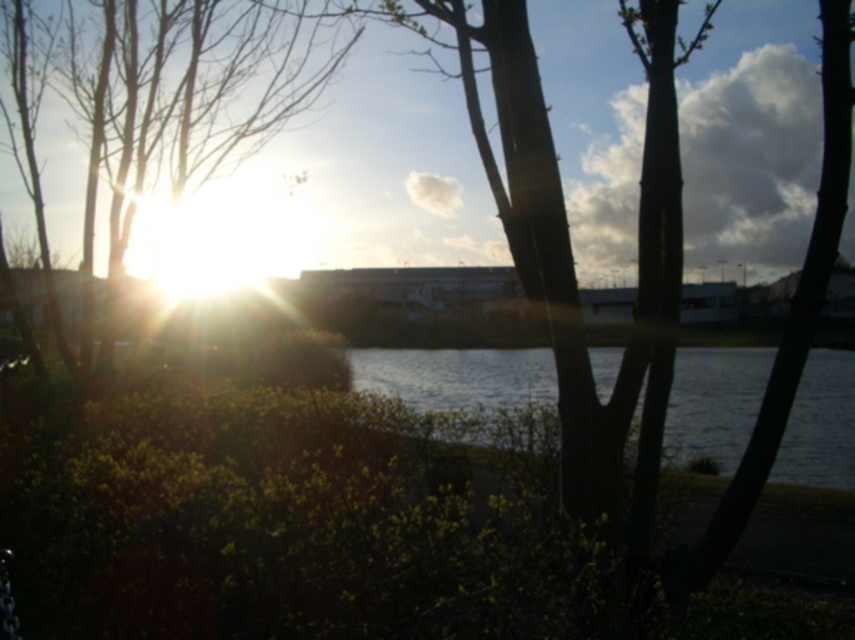
You are an artist setting up your easel to paint the scene. You want to ensure the bare branches at left and the silvery reflective water at center are both visible in your painting. Given their sizes, which object should you place closer to the foreground to maintain their visibility?

The bare branches at left should be placed closer to the foreground because they have a greater height compared to the silvery reflective water at center, ensuring their prominence in the painting.

You are an artist setting up your easel to paint the scene. You want to ensure the bare branches at left and silvery reflective water at center are both visible in your painting. Based on their positions, which object should you position closer to the left edge of your canvas?

The bare branches at left should be positioned closer to the left edge of the canvas since they are located to the left of the silvery reflective water at center.

You are an artist sketching the scene and want to place the bare branches at left accurately. According to the coordinates provided, where should you position them on your canvas?

The bare branches at left should be positioned at the coordinates point (x=187, y=96) on the canvas.